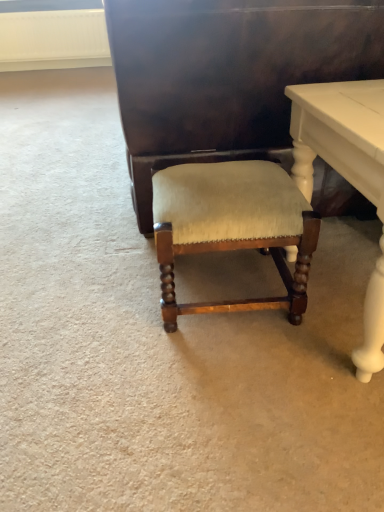
Locate an element on the screen. The height and width of the screenshot is (512, 384). vacant space underneath white glossy table at lower right (from a real-world perspective) is located at coordinates (340, 296).